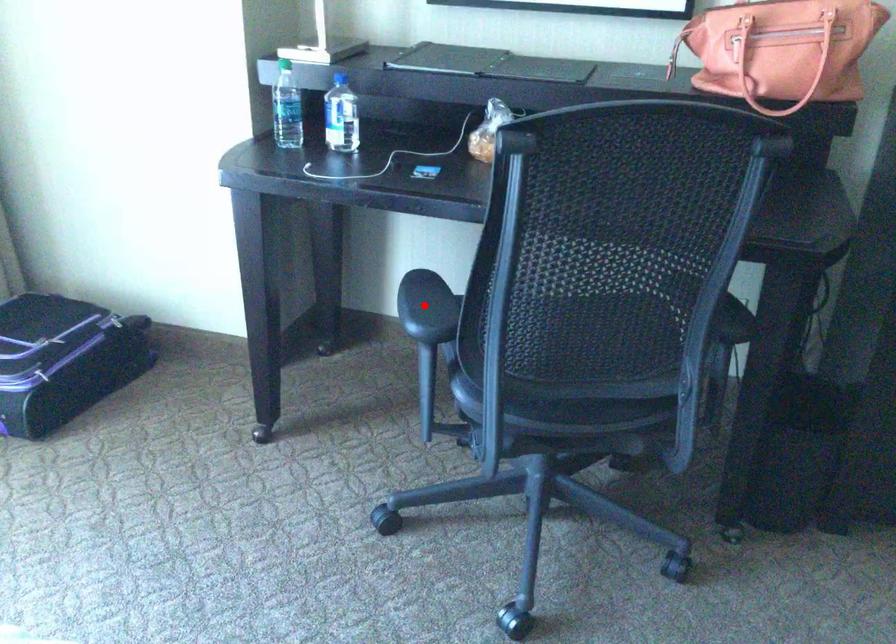
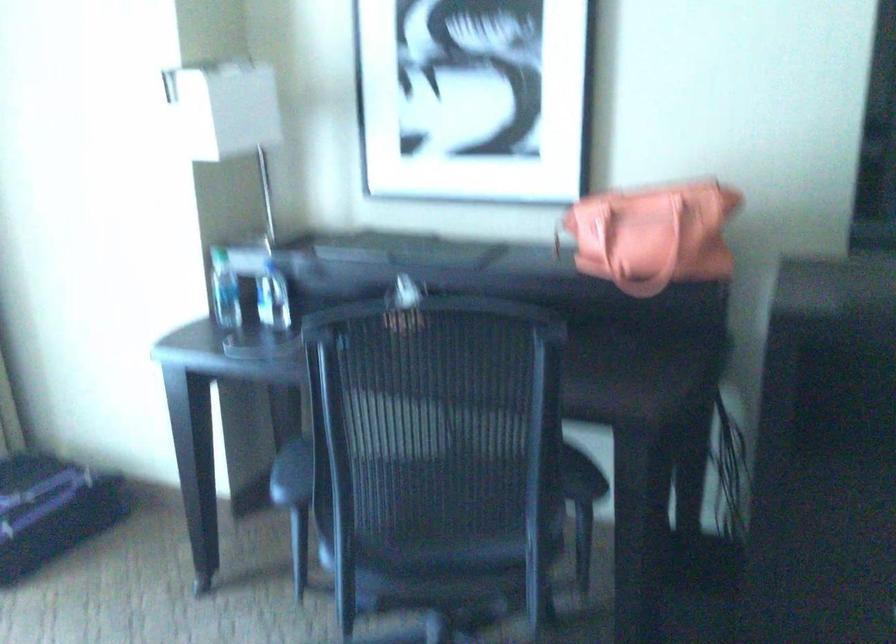
The point at the highlighted location is marked in the first image. Where is the corresponding point in the second image?

(291, 474)